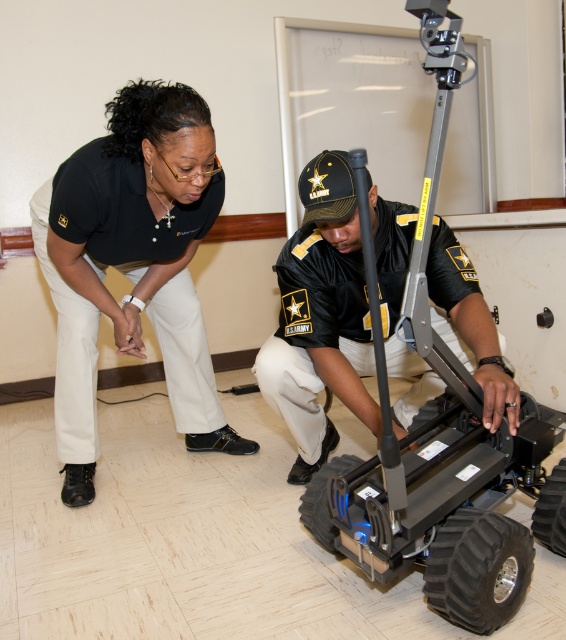
You are a maintenance technician who needs to inspect the robotic device. The black uniform at left is your colleague, and the black matte uniform at center is the robotic device. Can you safely walk between them to reach the device without getting too close to your colleague?

The distance between the black uniform at left and the black matte uniform at center is 20.19 inches, which is approximately 0.51 meters. Since a safe distance for walking is typically around 0.7 meters or more, you may want to adjust your path to maintain a safer distance of at least 0.7 meters between yourself and your colleague.

You are standing in the room and want to approach the black matte uniform at center. Which direction should you move from the black uniform at left?

To reach the black matte uniform at center from the black uniform at left, you should move to the right since the black uniform at left is positioned to the left of the black matte uniform at center.